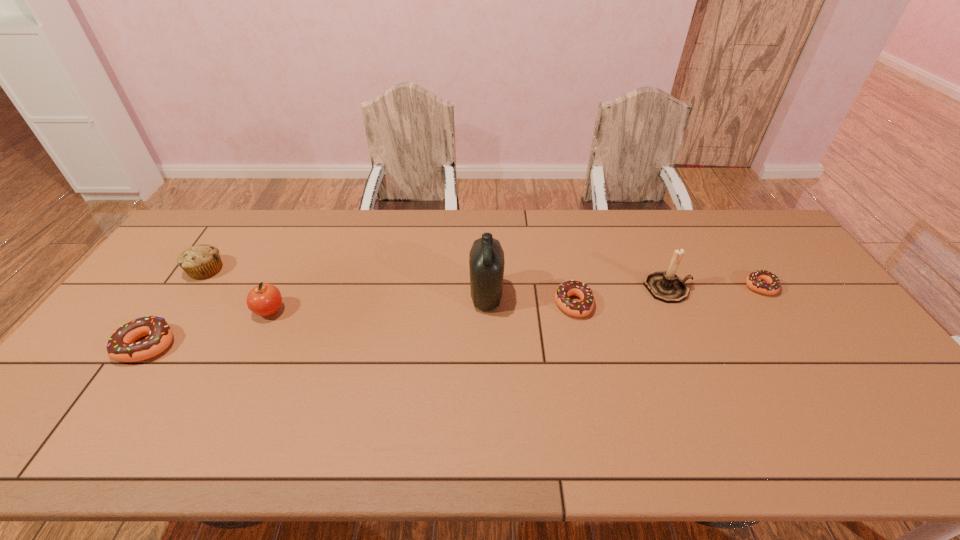
Locate which doughnut is the closest to the shortest object. Please provide its 2D coordinates. Your answer should be formatted as a tuple, i.e. [(x, y)], where the tuple contains the x and y coordinates of a point satisfying the conditions above.

[(569, 288)]

You are a GUI agent. You are given a task and a screenshot of the screen. Output one action in this format:
    pyautogui.click(x=<x>, y=<y>)
    Task: Click on the vacant point that satisfies the following two spatial constraints: 1. on the back side of the third object from left to right; 2. on the left side of the fourth object from left to right
    The width and height of the screenshot is (960, 540).
    Given the screenshot: What is the action you would take?
    pyautogui.click(x=276, y=297)

This screenshot has width=960, height=540. What are the coordinates of `vacant area that satisfies the following two spatial constraints: 1. on the back side of the tallest doughnut; 2. on the left side of the second tallest object` in the screenshot? It's located at click(x=186, y=288).